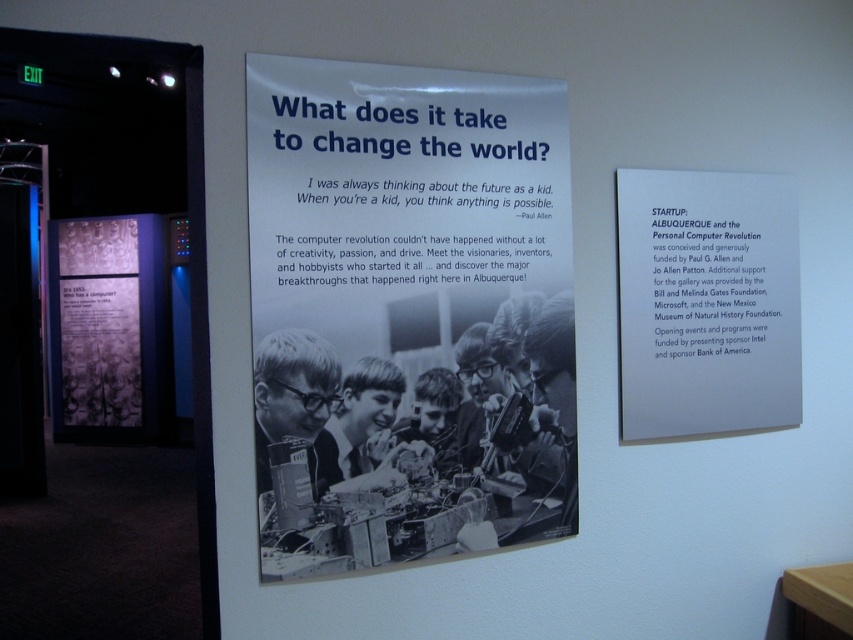
Is black paper poster at center thinner than translucent purple text at center?

Yes.

Between point (396, 284) and point (93, 326), which one is positioned in front?

Positioned in front is point (396, 284).

At what (x,y) coordinates should I click in order to perform the action: click on black paper poster at center. Please return your answer as a coordinate pair (x, y). The height and width of the screenshot is (640, 853). Looking at the image, I should click on (407, 314).

Is white paper at upper right to the left of translucent purple text at center from the viewer's perspective?

In fact, white paper at upper right is to the right of translucent purple text at center.

This screenshot has width=853, height=640. Describe the element at coordinates (706, 304) in the screenshot. I see `white paper at upper right` at that location.

At what (x,y) coordinates should I click in order to perform the action: click on white paper at upper right. Please return your answer as a coordinate pair (x, y). Looking at the image, I should click on (706, 304).

Measure the distance from black paper poster at center to white paper at upper right.

black paper poster at center and white paper at upper right are 46.76 centimeters apart.

Does black paper poster at center appear on the left side of white paper at upper right?

Correct, you'll find black paper poster at center to the left of white paper at upper right.

Does point (538, 93) come in front of point (625, 189)?

Yes, it is in front of point (625, 189).

Identify the location of black paper poster at center. The height and width of the screenshot is (640, 853). (407, 314).